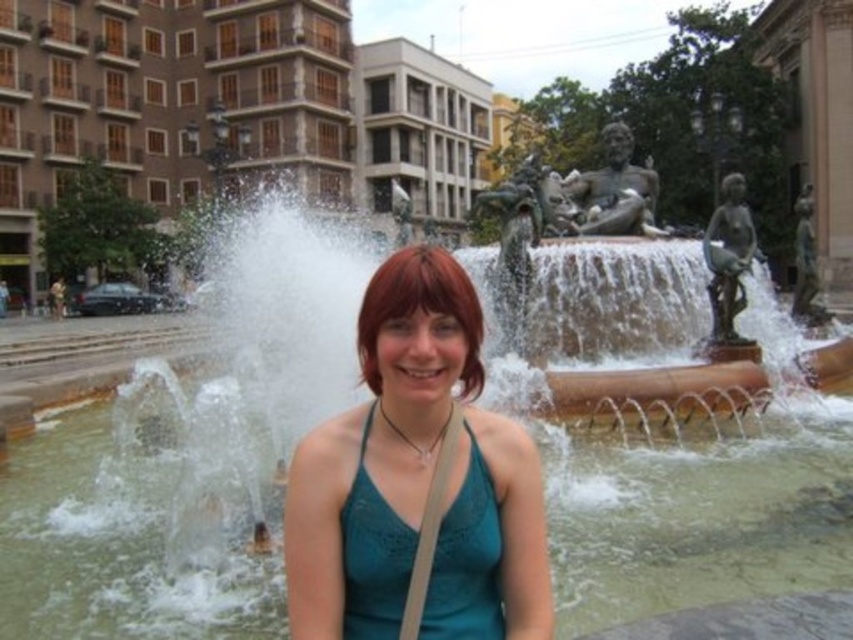
Based on the coordinates provided, where is the clear water at center located in the image?

The clear water at center is located at point (699,515) in the image.

You are standing in the urban scene with the fountain. There is a point at coordinates (699,515). What is located at that point?

The point at coordinates (699,515) corresponds to clear water at center.